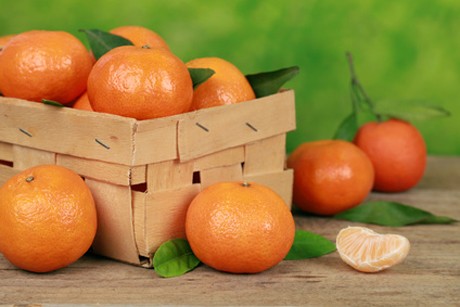
The image size is (460, 307). What are the coordinates of `staples on basket` in the screenshot? It's located at (25, 132), (92, 135), (201, 124), (249, 122).